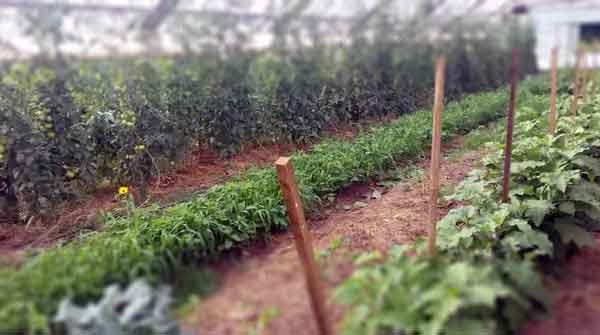
Find the location of a particular element. Image resolution: width=600 pixels, height=335 pixels. light green plants is located at coordinates (536, 203), (446, 220), (469, 231).